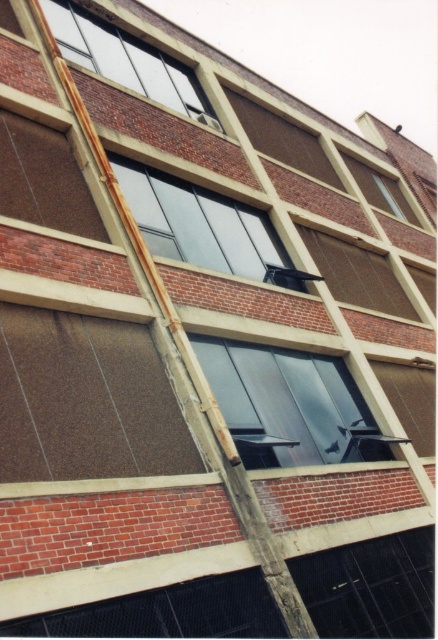
Question: From the image, what is the correct spatial relationship of matte black window at center in relation to transparent glass window at lower right?

Choices:
 (A) above
 (B) below

Answer: (A)

Question: Which point is farther to the camera?

Choices:
 (A) (382, 627)
 (B) (187, 195)
 (C) (197, 356)
 (D) (155, 60)

Answer: (D)

Question: Does matte black window at center have a larger size compared to clear glass window at upper center?

Choices:
 (A) no
 (B) yes

Answer: (B)

Question: Can you confirm if transparent glass window at center is bigger than clear glass window at upper right?

Choices:
 (A) no
 (B) yes

Answer: (B)

Question: Which object appears closest to the camera in this image?

Choices:
 (A) transparent glass window at center
 (B) matte black window at center
 (C) transparent glass window at lower right

Answer: (C)

Question: Which point is closer to the camera?

Choices:
 (A) coord(320,608)
 (B) coord(373,200)
 (C) coord(74,19)
 (D) coord(303,362)

Answer: (A)